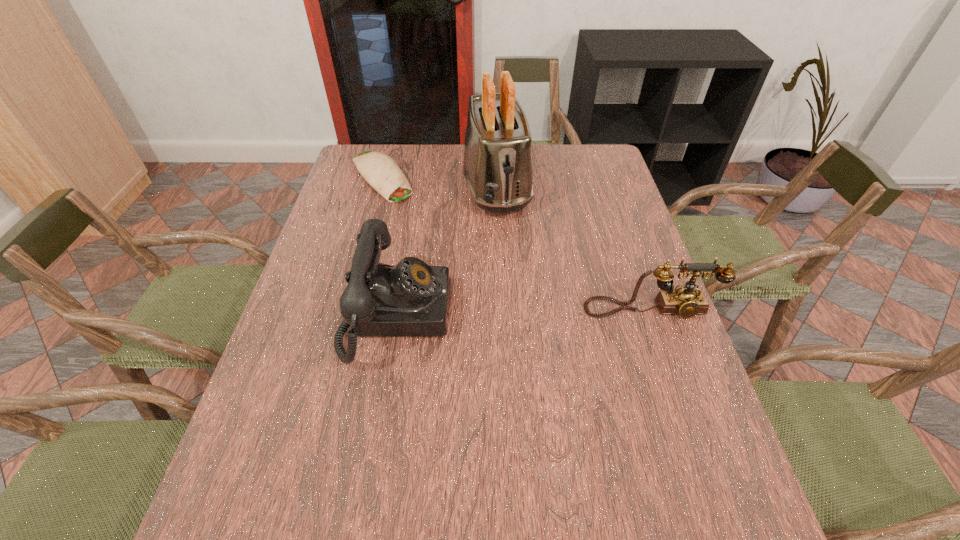
The height and width of the screenshot is (540, 960). Identify the location of the taller telephone. (411, 299).

You are a GUI agent. You are given a task and a screenshot of the screen. Output one action in this format:
    pyautogui.click(x=<x>, y=<y>)
    Task: Click on the left telephone
    The image size is (960, 540).
    Given the screenshot: What is the action you would take?
    pyautogui.click(x=411, y=299)

Image resolution: width=960 pixels, height=540 pixels. I want to click on the third tallest object, so click(685, 301).

This screenshot has height=540, width=960. In order to click on the shorter telephone in this screenshot , I will do click(685, 301).

At what (x,y) coordinates should I click in order to perform the action: click on the tallest object. Please return your answer as a coordinate pair (x, y). The width and height of the screenshot is (960, 540). Looking at the image, I should click on (497, 166).

This screenshot has height=540, width=960. Find the location of `toaster`. toaster is located at coordinates (497, 166).

At what (x,y) coordinates should I click in order to perform the action: click on the shortest object. Please return your answer as a coordinate pair (x, y). Looking at the image, I should click on (378, 169).

Where is `free space located on the dial of the second tallest object`? free space located on the dial of the second tallest object is located at coordinates (614, 315).

You are a GUI agent. You are given a task and a screenshot of the screen. Output one action in this format:
    pyautogui.click(x=<x>, y=<y>)
    Task: Click on the free location located 0.080m on the front-facing side of the rightmost object
    
    Given the screenshot: What is the action you would take?
    pyautogui.click(x=664, y=349)

Locate an element on the screen. vacant space located on the side of the third object from left to right with the control lever is located at coordinates (509, 245).